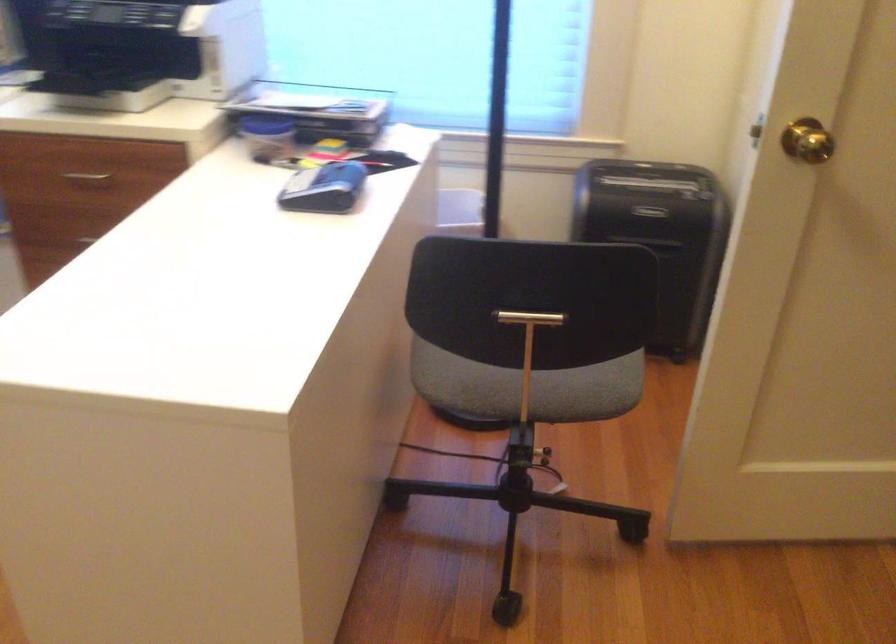
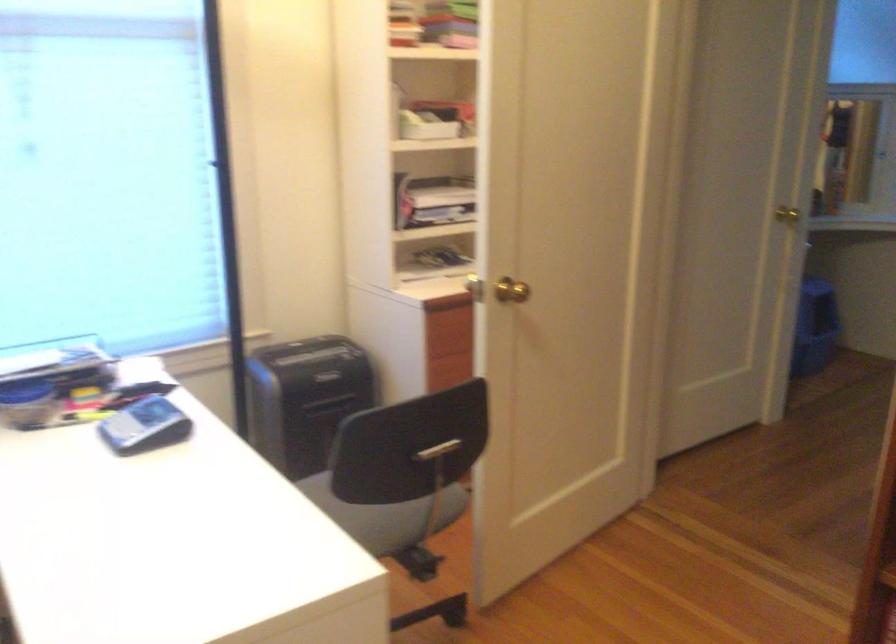
Question: The camera is either moving clockwise (left) or counter-clockwise (right) around the object. The first image is from the beginning of the video and the second image is from the end. Is the camera moving left or right when shooting the video?

Choices:
 (A) Left
 (B) Right

Answer: (A)